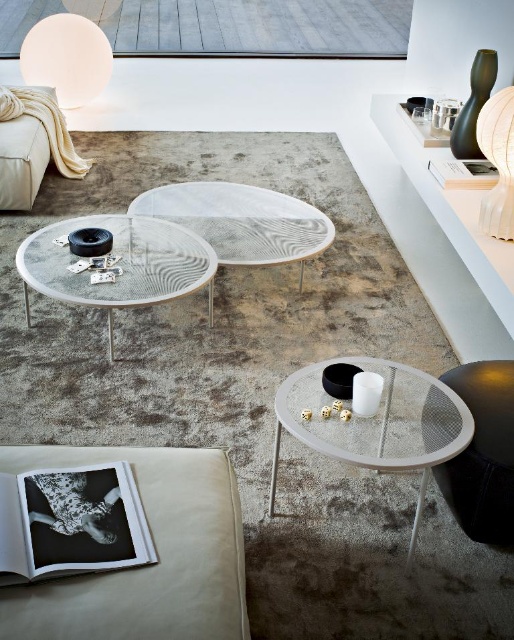
Between beige leather couch at lower left and transparent mesh side table at center, which one has more height?

transparent mesh side table at center

Can you confirm if beige leather couch at lower left is smaller than transparent mesh side table at center?

Yes, beige leather couch at lower left is smaller than transparent mesh side table at center.

Identify the location of beige leather couch at lower left. (171, 540).

At what (x,y) coordinates should I click in order to perform the action: click on beige leather couch at lower left. Please return your answer as a coordinate pair (x, y). The height and width of the screenshot is (640, 514). Looking at the image, I should click on (171, 540).

Who is taller, beige leather couch at lower left or white paper lampshade at upper right?

Standing taller between the two is white paper lampshade at upper right.

Does beige leather couch at lower left appear under white paper lampshade at upper right?

Yes, beige leather couch at lower left is below white paper lampshade at upper right.

I want to click on beige leather couch at lower left, so click(x=171, y=540).

Locate an element on the screen. beige leather couch at lower left is located at coordinates (171, 540).

Who is higher up, beige leather couch at lower left or white marble side table at center?

white marble side table at center is above.

Is point (134, 456) positioned before point (247, 228)?

Yes, point (134, 456) is in front of point (247, 228).

Is point (238, 548) positioned behind point (257, 227)?

No, it is not.

What are the coordinates of `beige leather couch at lower left` in the screenshot? It's located at (171, 540).